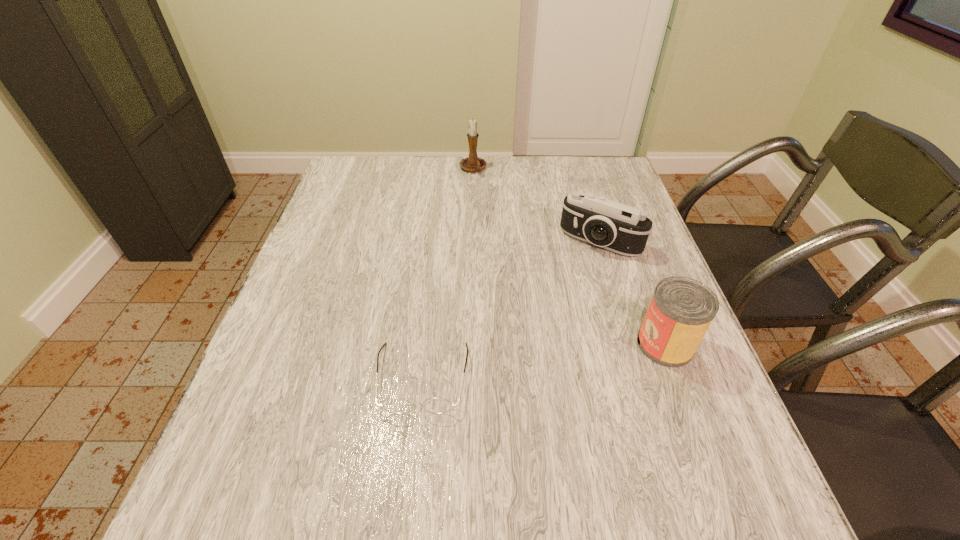
The width and height of the screenshot is (960, 540). Find the location of `empty location between the can and the farthest object`. empty location between the can and the farthest object is located at coordinates [569, 256].

You are a GUI agent. You are given a task and a screenshot of the screen. Output one action in this format:
    pyautogui.click(x=<x>, y=<y>)
    Task: Click on the free spot between the can and the farthest object
    This screenshot has width=960, height=540.
    Given the screenshot: What is the action you would take?
    pyautogui.click(x=569, y=256)

Identify which object is the third nearest to the farthest object. Please provide its 2D coordinates. Your answer should be formatted as a tuple, i.e. [(x, y)], where the tuple contains the x and y coordinates of a point satisfying the conditions above.

[(681, 310)]

Identify which object is the third nearest to the spectacles. Please provide its 2D coordinates. Your answer should be formatted as a tuple, i.e. [(x, y)], where the tuple contains the x and y coordinates of a point satisfying the conditions above.

[(473, 163)]

Locate an element on the screen. The height and width of the screenshot is (540, 960). vacant region that satisfies the following two spatial constraints: 1. on the front side of the camera; 2. on the left side of the farthest object is located at coordinates (471, 241).